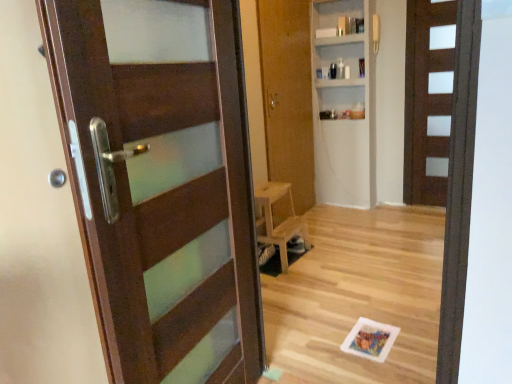
Question: Does matte brown door at left, positioned as the 3th door in back-to-front order, have a lesser width compared to brown matte door at right, the first door in the back-to-front sequence?

Choices:
 (A) yes
 (B) no

Answer: (B)

Question: Are matte brown door at left, positioned as the 3th door in back-to-front order, and brown matte door at right, arranged as the third door when viewed from the front, located far from each other?

Choices:
 (A) yes
 (B) no

Answer: (A)

Question: Are matte brown door at left, positioned as the third door in right-to-left order, and brown matte door at right, the first door in the back-to-front sequence, beside each other?

Choices:
 (A) yes
 (B) no

Answer: (B)

Question: Is matte brown door at left, acting as the 1th door starting from the front, at the right side of brown matte door at right, which is counted as the 1th door, starting from the right?

Choices:
 (A) no
 (B) yes

Answer: (A)

Question: Is matte brown door at left, positioned as the third door in right-to-left order, positioned beyond the bounds of brown matte door at right, which is counted as the 1th door, starting from the right?

Choices:
 (A) yes
 (B) no

Answer: (A)

Question: From the image's perspective, is brown matte door at right, positioned as the 3th door in left-to-right order, positioned above or below white matte bookshelf at upper center?

Choices:
 (A) above
 (B) below

Answer: (B)

Question: Considering the positions of point (414, 135) and point (359, 122), is point (414, 135) closer or farther from the camera than point (359, 122)?

Choices:
 (A) closer
 (B) farther

Answer: (A)

Question: Is brown matte door at right, which is counted as the 1th door, starting from the right, taller or shorter than white matte bookshelf at upper center?

Choices:
 (A) tall
 (B) short

Answer: (B)

Question: Visually, is brown matte door at right, arranged as the third door when viewed from the front, positioned to the left or to the right of white matte bookshelf at upper center?

Choices:
 (A) left
 (B) right

Answer: (B)

Question: Would you say brown matte door at right, the first door in the back-to-front sequence, is inside or outside wooden chair at center?

Choices:
 (A) outside
 (B) inside

Answer: (A)

Question: From a real-world perspective, relative to wooden chair at center, is brown matte door at right, the first door in the back-to-front sequence, vertically above or below?

Choices:
 (A) above
 (B) below

Answer: (A)

Question: In terms of width, does brown matte door at right, arranged as the third door when viewed from the front, look wider or thinner when compared to wooden chair at center?

Choices:
 (A) thin
 (B) wide

Answer: (A)

Question: Is point (418, 195) positioned closer to the camera than point (272, 223)?

Choices:
 (A) closer
 (B) farther

Answer: (B)

Question: From the image's perspective, is wooden chair at center above or below matte brown door at left, positioned as the third door in right-to-left order?

Choices:
 (A) below
 (B) above

Answer: (A)

Question: Is point (287, 183) closer or farther from the camera than point (175, 321)?

Choices:
 (A) farther
 (B) closer

Answer: (A)